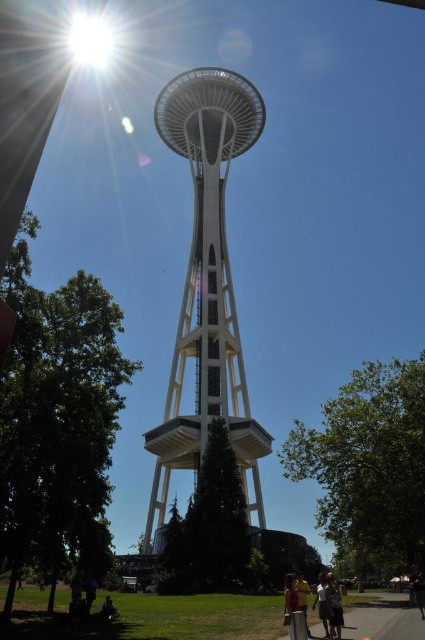
You are a photographer aiming to capture the Space Needle with a person in the foreground. The person has dark brown hair at lower center. If you want to ensure the person is centered in the frame, would you need to adjust the camera position to the left or right? Please explain based on the coordinates provided.

The dark brown hair at lower center is located at coordinates point (334,608). Since the x coordinate is 0.950, which is close to the right edge of the frame, you would need to adjust the camera position to the right to center the person in the frame.

You are a photographer trying to capture a group photo of two people wearing the white cotton shirt at lower center and the matte yellow shirt at lower center. Since you want both shirts to be clearly visible in the photo, which shirt should you focus on to ensure it doesn t get cropped out?

The white cotton shirt at lower center occupies less space than the matte yellow shirt at lower center, so you should focus on the matte yellow shirt at lower center to ensure it doesn t get cropped out.

You are standing in the Seattle area and see the Space Needle. You are wearing a white cotton shirt at lower center. If you want to take a photo of the Space Needle with your shirt visible in the foreground, will you need to adjust your position to ensure both the shirt and the Space Needle are in focus?

The white cotton shirt at lower center is 95.06 meters away from viewer. To have both the shirt and the Space Needle in focus, you would need to adjust your position or use a smaller aperture setting on your camera to increase depth of field.